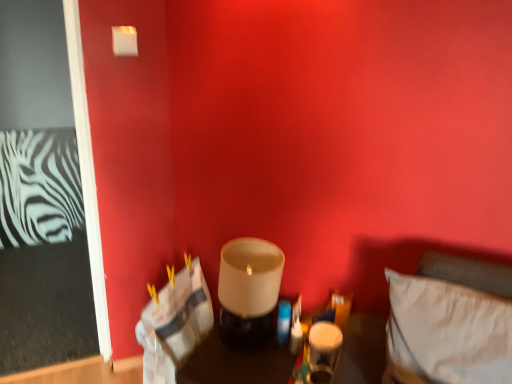
Question: Is translucent glass candle holder at center looking in the opposite direction of matte white glass at lower center, the first candle holder in the right-to-left sequence?

Choices:
 (A) no
 (B) yes

Answer: (A)

Question: Is translucent glass candle holder at center wider than matte white glass at lower center, the first candle holder in the right-to-left sequence?

Choices:
 (A) yes
 (B) no

Answer: (A)

Question: Is translucent glass candle holder at center at the right side of matte white glass at lower center, the first candle holder in the right-to-left sequence?

Choices:
 (A) no
 (B) yes

Answer: (A)

Question: From a real-world perspective, is translucent glass candle holder at center located beneath matte white glass at lower center, marked as the second candle holder in a left-to-right arrangement?

Choices:
 (A) no
 (B) yes

Answer: (B)

Question: From a real-world perspective, does translucent glass candle holder at center stand above matte white glass at lower center, marked as the second candle holder in a left-to-right arrangement?

Choices:
 (A) yes
 (B) no

Answer: (B)

Question: Looking at their shapes, would you say matte white glass at lower center, marked as the second candle holder in a left-to-right arrangement, is wider or thinner than white fabric pillow at lower right?

Choices:
 (A) thin
 (B) wide

Answer: (A)

Question: Considering the relative positions of matte white glass at lower center, marked as the second candle holder in a left-to-right arrangement, and white fabric pillow at lower right in the image provided, is matte white glass at lower center, marked as the second candle holder in a left-to-right arrangement, to the left or to the right of white fabric pillow at lower right?

Choices:
 (A) right
 (B) left

Answer: (B)

Question: In terms of height, does matte white glass at lower center, the first candle holder in the right-to-left sequence, look taller or shorter compared to white fabric pillow at lower right?

Choices:
 (A) short
 (B) tall

Answer: (A)

Question: From the image's perspective, relative to white fabric pillow at lower right, is matte white glass at lower center, marked as the second candle holder in a left-to-right arrangement, above or below?

Choices:
 (A) above
 (B) below

Answer: (B)

Question: Considering their positions, is translucent glass candle holder at center located in front of or behind matte white glass at center, placed as the first candle holder when sorted from left to right?

Choices:
 (A) front
 (B) behind

Answer: (A)

Question: From the image's perspective, is translucent glass candle holder at center above or below matte white glass at center, placed as the first candle holder when sorted from left to right?

Choices:
 (A) below
 (B) above

Answer: (A)

Question: From a real-world perspective, is translucent glass candle holder at center above or below matte white glass at center, placed as the first candle holder when sorted from left to right?

Choices:
 (A) below
 (B) above

Answer: (A)

Question: Looking at the image, does translucent glass candle holder at center seem bigger or smaller compared to matte white glass at center, marked as the second candle holder in a right-to-left arrangement?

Choices:
 (A) small
 (B) big

Answer: (B)

Question: In the image, is matte white glass at center, placed as the first candle holder when sorted from left to right, positioned in front of or behind matte white glass at lower center, marked as the second candle holder in a left-to-right arrangement?

Choices:
 (A) front
 (B) behind

Answer: (A)

Question: From a real-world perspective, is matte white glass at center, placed as the first candle holder when sorted from left to right, physically located above or below matte white glass at lower center, marked as the second candle holder in a left-to-right arrangement?

Choices:
 (A) below
 (B) above

Answer: (B)